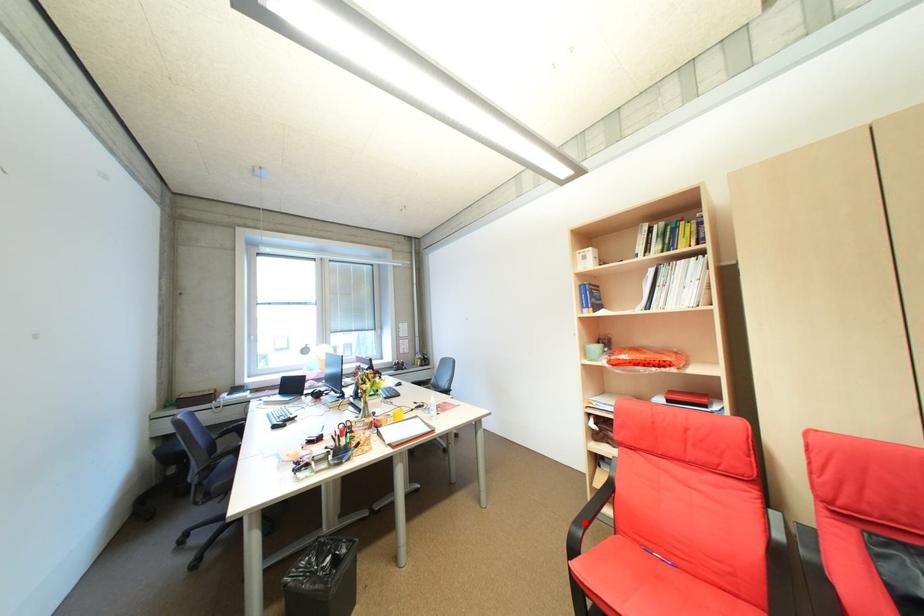
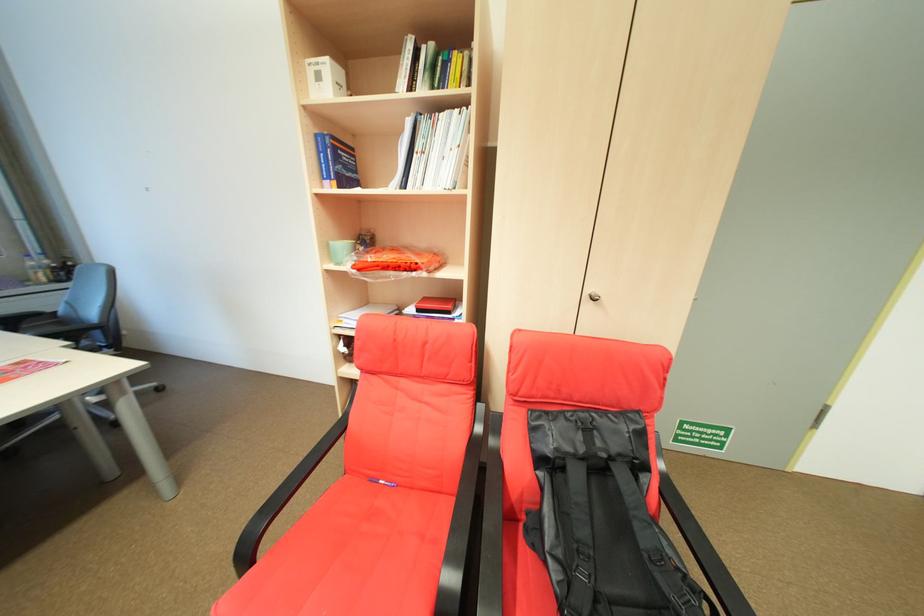
Find the pixel in the second image that matches the highlighted location in the first image.

(271, 513)